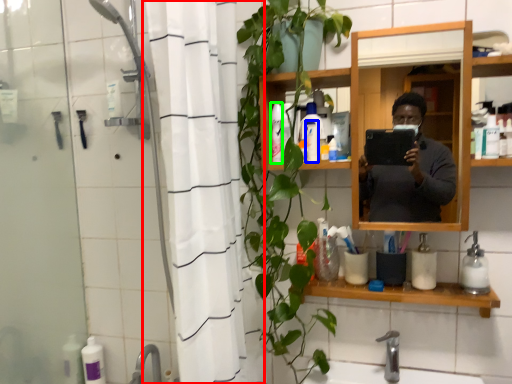
Question: Which object is the closest to the shower curtain (highlighted by a red box)? Choose among these: toiletry (highlighted by a blue box) or toiletry (highlighted by a green box).

Choices:
 (A) toiletry
 (B) toiletry

Answer: (B)